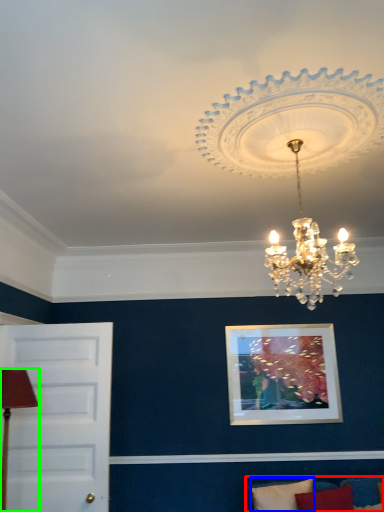
Question: Which object is the farthest from couch (highlighted by a red box)? Choose among these: pillow (highlighted by a blue box) or table lamp (highlighted by a green box).

Choices:
 (A) pillow
 (B) table lamp

Answer: (B)